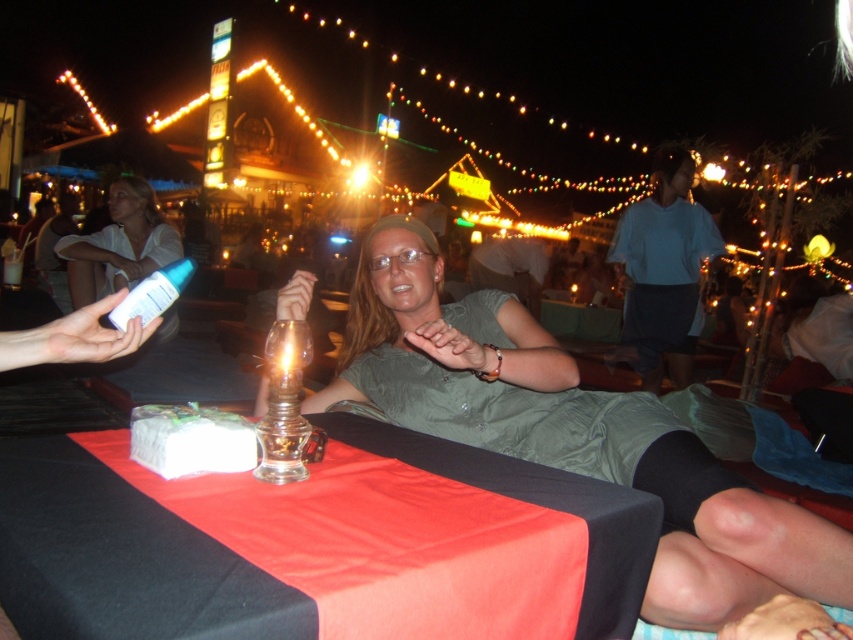
You are at a social event and see a person wearing a dress. Where is the matte green dress at center located in the image?

The matte green dress at center is located at point coordinates of (582, 442).

You are a photographer at this event and want to capture both the matte green dress at center and the light blue shirt at center in a single shot. Based on their positions, which one is closer to the camera?

The matte green dress at center is below the light blue shirt at center, so the light blue shirt at center is closer to the camera.

You are standing at the edge of the gathering and want to find the matte green dress at center. Based on the coordinates provided, can you estimate its position relative to the table?

The matte green dress at center is located at coordinates approximately 0.691 on the x axis and 0.683 on the y axis, which places it near the center of the image. Since the table is in the foreground, the dress is likely positioned slightly to the right and above the table area.